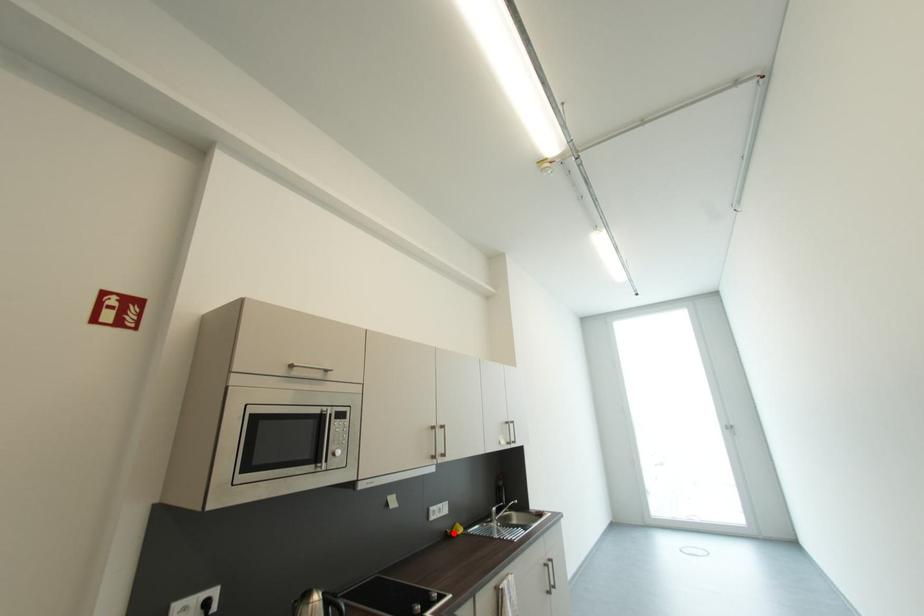
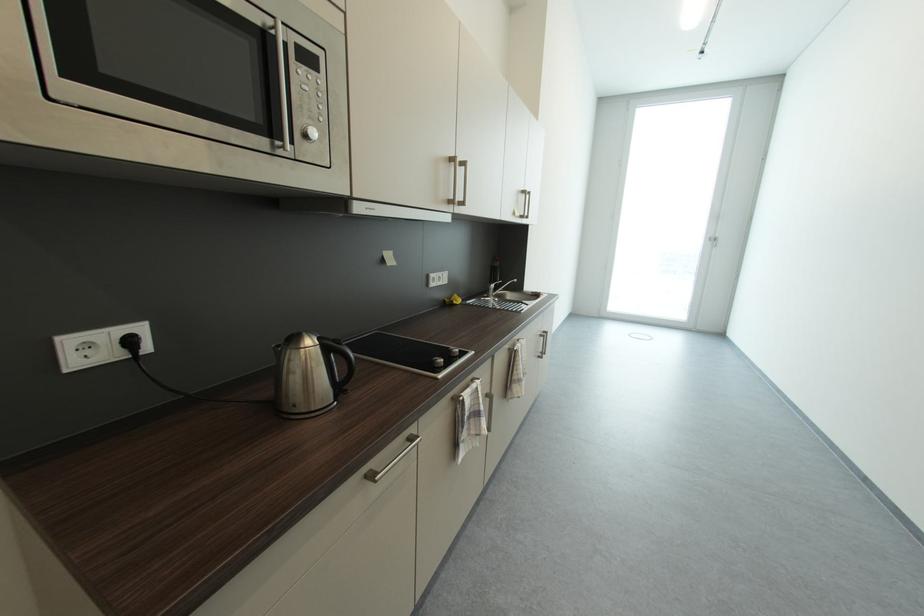
Question: I am providing you with two images of the same scene from different viewpoints. In image1, a red point is highlighted. Considering the same 3D point in image2, which of the following is correct?

Choices:
 (A) It is closer
 (B) It is farther

Answer: (A)